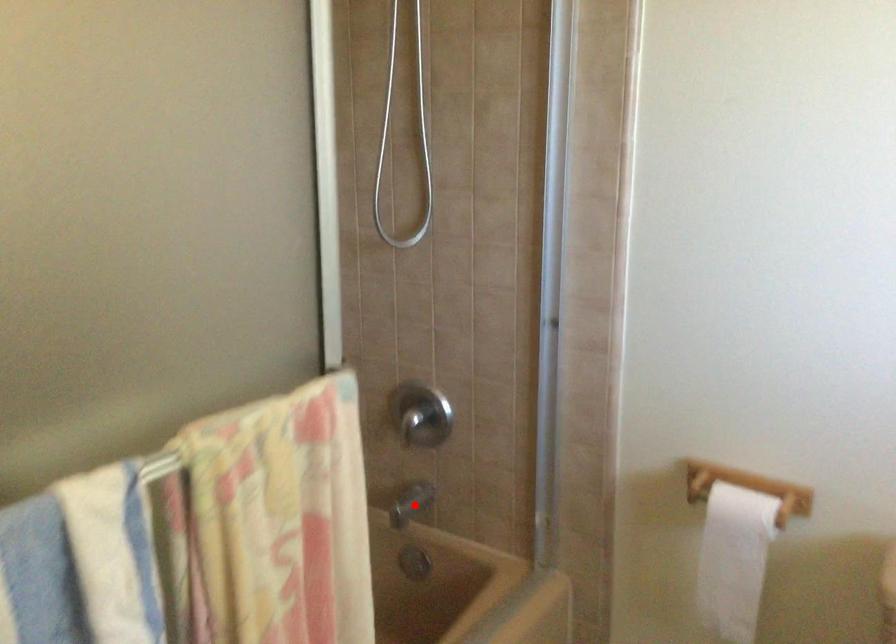
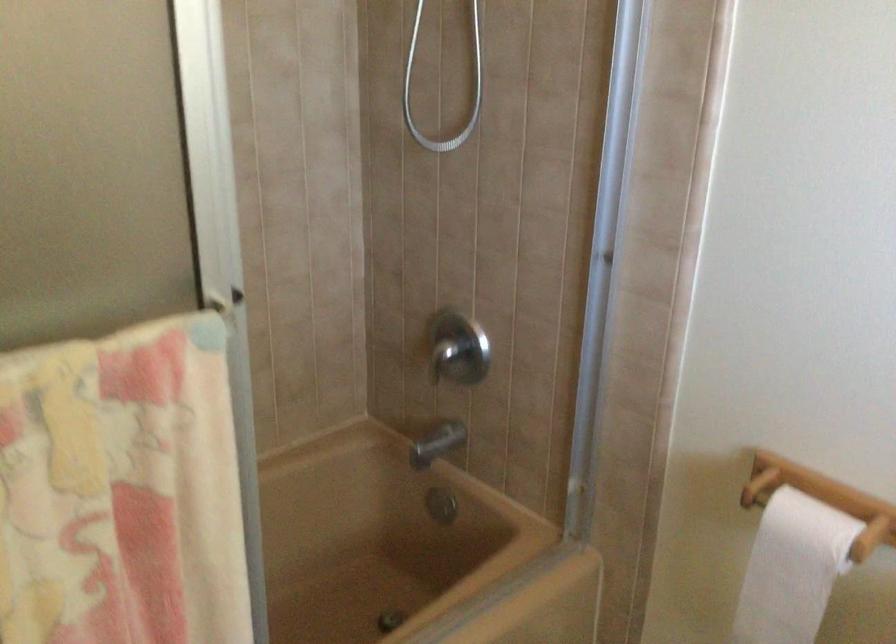
Find the pixel in the second image that matches the highlighted location in the first image.

(436, 444)